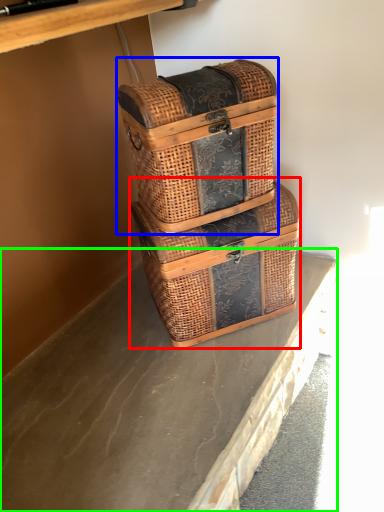
Question: Considering the real-world distances, which object is closest to picnic basket (highlighted by a red box)? picnic basket (highlighted by a blue box) or concrete (highlighted by a green box).

Choices:
 (A) picnic basket
 (B) concrete

Answer: (A)